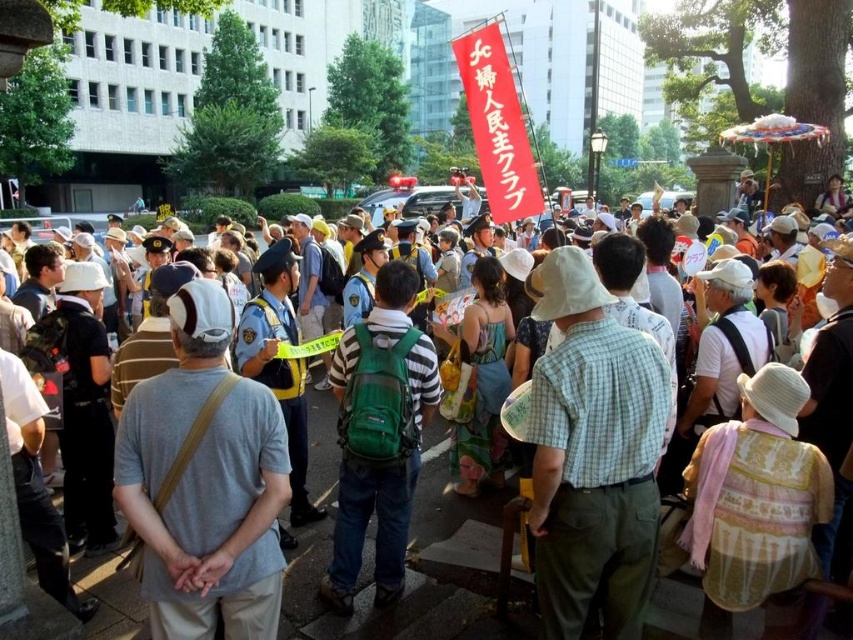
Who is taller, woven fabric hat at center or blue floral dress at center?

With more height is blue floral dress at center.

This screenshot has height=640, width=853. I want to click on woven fabric hat at center, so click(756, 508).

The width and height of the screenshot is (853, 640). In order to click on woven fabric hat at center in this screenshot , I will do `click(756, 508)`.

Who is taller, green backpack at center or pink woven hat at center?

green backpack at center

Is point (367, 564) positioned before point (828, 202)?

Yes, it is in front of point (828, 202).

The height and width of the screenshot is (640, 853). Describe the element at coordinates (410, 566) in the screenshot. I see `green backpack at center` at that location.

Where is `green backpack at center`? The image size is (853, 640). green backpack at center is located at coordinates (410, 566).

Does green backpack at center have a smaller size compared to blue floral dress at center?

No.

This screenshot has width=853, height=640. What do you see at coordinates (410, 566) in the screenshot?
I see `green backpack at center` at bounding box center [410, 566].

Who is more forward, (421, 602) or (459, 337)?

Point (421, 602) is in front.

Locate an element on the screen. green backpack at center is located at coordinates (410, 566).